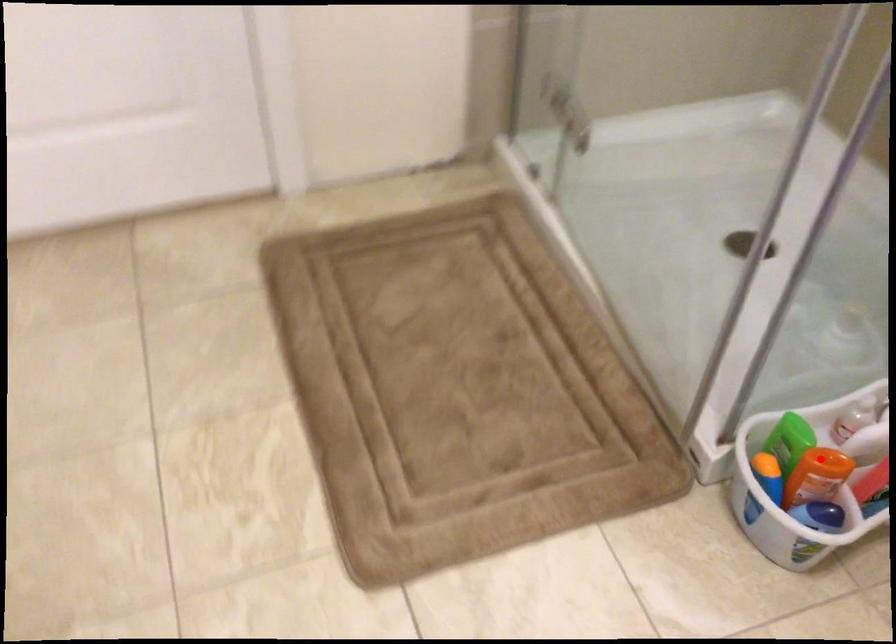
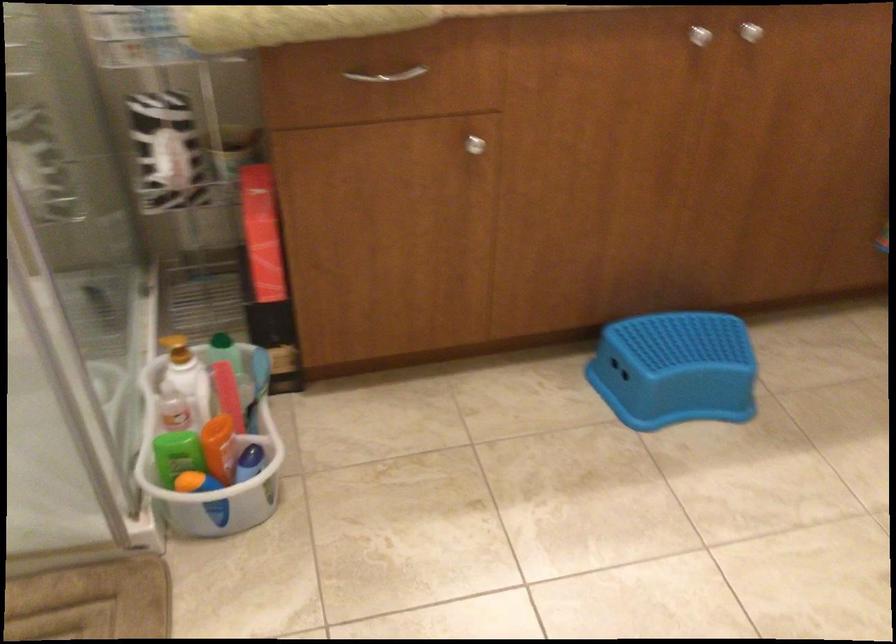
Where in the second image is the point corresponding to the highlighted location from the first image?

(208, 439)